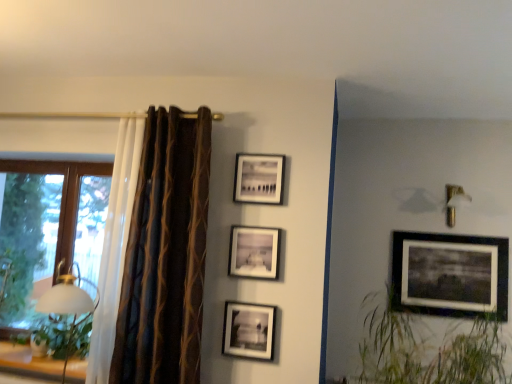
Question: From the image's perspective, is matte black picture frame at upper center, acting as the 2th picture frame starting from the back, under matte black picture frame at center, the second picture frame in the left-to-right sequence?

Choices:
 (A) yes
 (B) no

Answer: (B)

Question: From a real-world perspective, is matte black picture frame at upper center, acting as the 2th picture frame starting from the back, physically below matte black picture frame at center, arranged as the third picture frame when viewed from the back?

Choices:
 (A) no
 (B) yes

Answer: (A)

Question: Is matte black picture frame at upper center, the third picture frame positioned from the left, not within matte black picture frame at center, arranged as the 3th picture frame when viewed from the right?

Choices:
 (A) yes
 (B) no

Answer: (A)

Question: Does matte black picture frame at upper center, which is the second picture frame in right-to-left order, appear on the right side of matte black picture frame at center, the second picture frame in the left-to-right sequence?

Choices:
 (A) yes
 (B) no

Answer: (A)

Question: Could matte black picture frame at center, which is counted as the 2th picture frame, starting from the front, be considered to be inside matte black picture frame at upper center, the third picture frame positioned from the left?

Choices:
 (A) yes
 (B) no

Answer: (B)

Question: Is matte black picture frame at upper center, placed as the 3th picture frame when sorted from front to back, aimed at matte black picture frame at center, arranged as the 3th picture frame when viewed from the right?

Choices:
 (A) no
 (B) yes

Answer: (A)

Question: Can you confirm if green grass at right is wider than matte black picture frame at center, the 4th picture frame positioned from the right?

Choices:
 (A) no
 (B) yes

Answer: (B)

Question: Can you confirm if green grass at right is thinner than matte black picture frame at center, which appears as the first picture frame when viewed from the left?

Choices:
 (A) yes
 (B) no

Answer: (B)

Question: Is green grass at right at the left side of matte black picture frame at center, the 4th picture frame positioned from the right?

Choices:
 (A) yes
 (B) no

Answer: (B)

Question: Is green grass at right positioned beyond the bounds of matte black picture frame at center, the fourth picture frame in the back-to-front sequence?

Choices:
 (A) no
 (B) yes

Answer: (B)

Question: Does green grass at right have a smaller size compared to matte black picture frame at center, which appears as the first picture frame when viewed from the left?

Choices:
 (A) yes
 (B) no

Answer: (B)

Question: Is green grass at right at the right side of matte black picture frame at center, the 4th picture frame positioned from the right?

Choices:
 (A) no
 (B) yes

Answer: (B)

Question: Considering the relative sizes of green leafy plant at left and matte black picture frame at center, the second picture frame in the left-to-right sequence, in the image provided, is green leafy plant at left smaller than matte black picture frame at center, the second picture frame in the left-to-right sequence,?

Choices:
 (A) no
 (B) yes

Answer: (A)